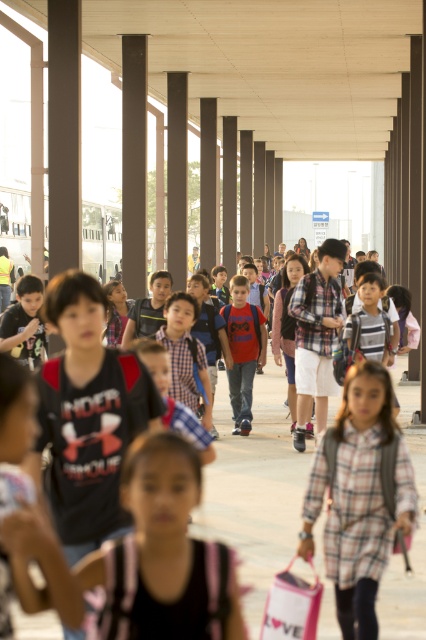
Who is lower down, plaid shirt at center or matte red shirt at center?

plaid shirt at center

Is point (362, 616) positioned in front of point (236, 330)?

That is True.

Between point (353, 432) and point (262, 320), which one is positioned in front?

Positioned in front is point (353, 432).

Locate an element on the screen. The image size is (426, 640). plaid shirt at center is located at coordinates (363, 499).

Is matte red shirt at center below matte black backpack at center?

Indeed, matte red shirt at center is positioned under matte black backpack at center.

Is matte red shirt at center taller than matte black backpack at center?

Correct, matte red shirt at center is much taller as matte black backpack at center.

Who is more distant from viewer, (224,326) or (37,289)?

Point (224,326)

Where is `matte red shirt at center`? matte red shirt at center is located at coordinates point(242,349).

Between plaid shirt at center and matte black backpack at center, which one has less height?

matte black backpack at center

Between plaid shirt at center and matte black backpack at center, which one appears on the left side from the viewer's perspective?

From the viewer's perspective, matte black backpack at center appears more on the left side.

Is point (354, 500) in front of point (28, 301)?

That is True.

Locate an element on the screen. plaid shirt at center is located at coordinates (363, 499).